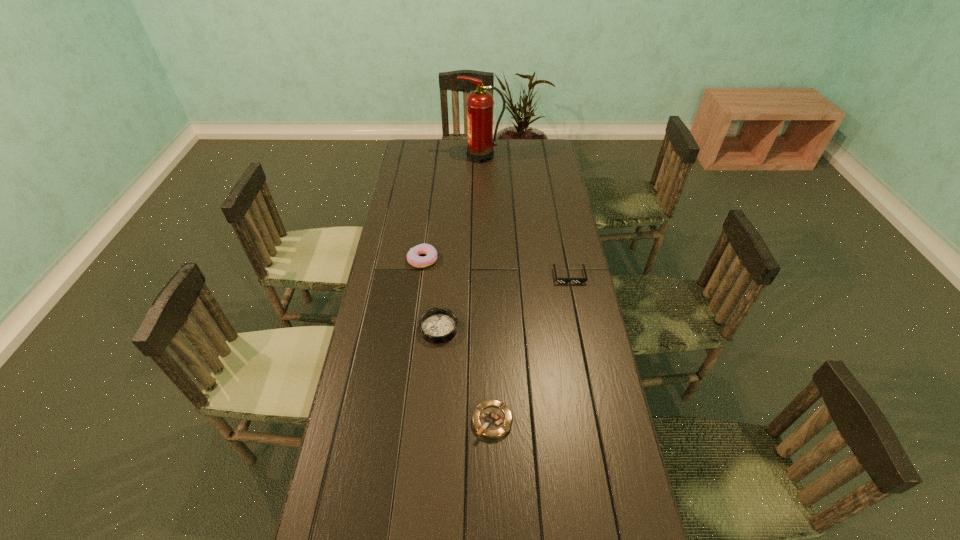
At what (x,y) coordinates should I click in order to perform the action: click on the farthest object. Please return your answer as a coordinate pair (x, y). Looking at the image, I should click on (481, 141).

The height and width of the screenshot is (540, 960). In order to click on the tallest object in this screenshot , I will do `click(481, 141)`.

This screenshot has height=540, width=960. In order to click on doughnut in this screenshot , I will do `click(413, 258)`.

Identify the location of the farther ashtray. The image size is (960, 540). (437, 325).

Locate an element on the screen. This screenshot has width=960, height=540. the left ashtray is located at coordinates (437, 325).

Identify the location of the right ashtray. The width and height of the screenshot is (960, 540). (491, 419).

You are a GUI agent. You are given a task and a screenshot of the screen. Output one action in this format:
    pyautogui.click(x=<x>, y=<y>)
    Task: Click on the nearest object
    This screenshot has height=540, width=960.
    Given the screenshot: What is the action you would take?
    pos(491,419)

Where is `sunglasses`? sunglasses is located at coordinates (560, 280).

The width and height of the screenshot is (960, 540). Find the location of `free point located 0.050m on the front-facing side of the fire extinguisher`. free point located 0.050m on the front-facing side of the fire extinguisher is located at coordinates (450, 156).

Identify the location of vacant space located 0.240m on the front-facing side of the fire extinguisher. The height and width of the screenshot is (540, 960). (412, 156).